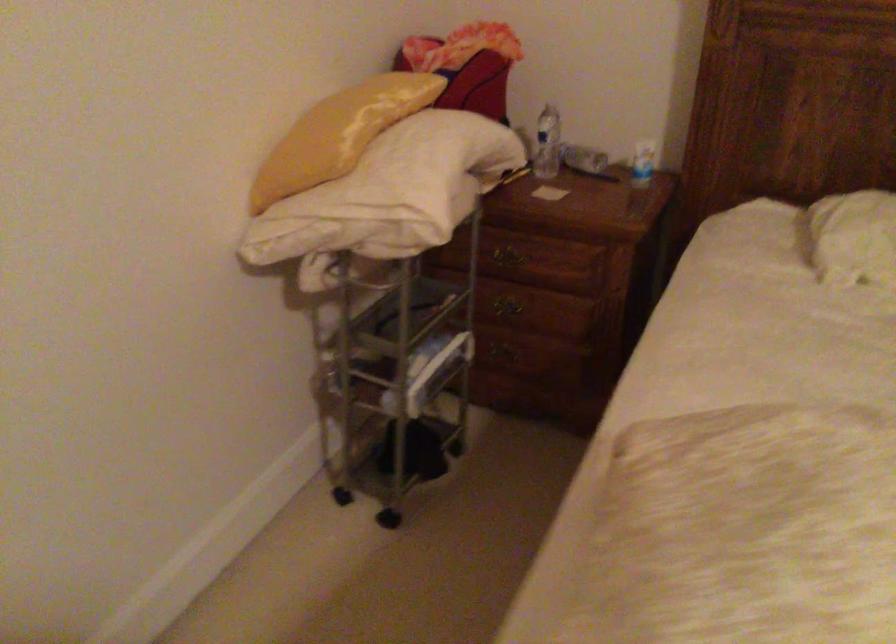
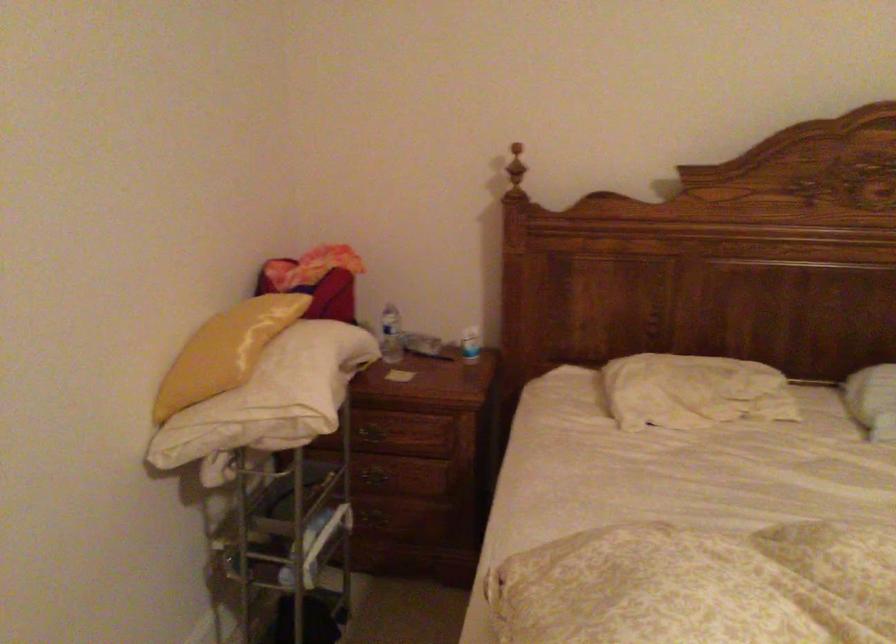
Locate, in the second image, the point that corresponds to pixel 544 143 in the first image.

(391, 335)